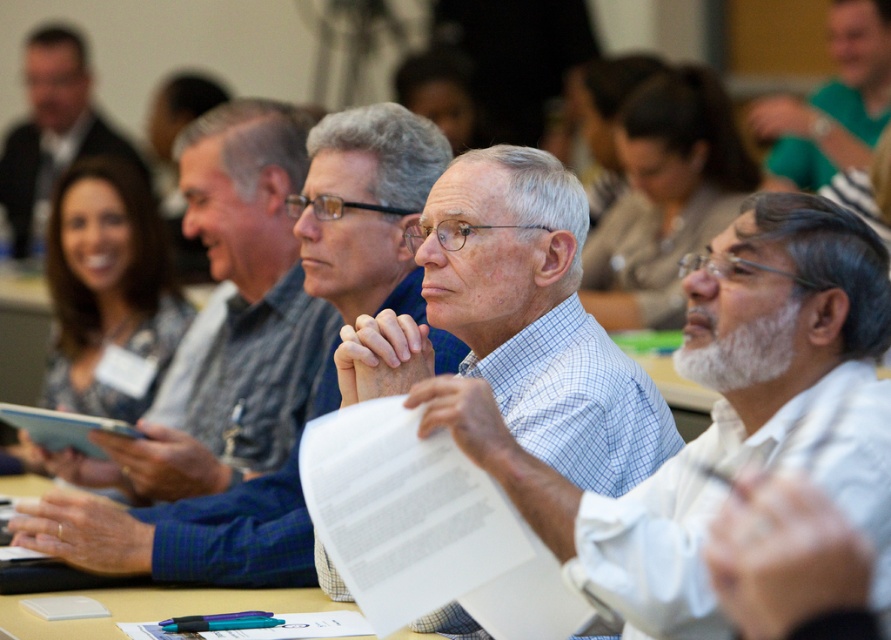
How far apart are blue plaid shirt at center and green jersey at upper right?

blue plaid shirt at center and green jersey at upper right are 2.22 meters apart.

Between blue plaid shirt at center and green jersey at upper right, which one is positioned lower?

blue plaid shirt at center

What do you see at coordinates (233, 316) in the screenshot? I see `blue plaid shirt at center` at bounding box center [233, 316].

Locate an element on the screen. The height and width of the screenshot is (640, 891). blue plaid shirt at center is located at coordinates (233, 316).

Does blue checkered shirt at center have a lesser width compared to matte black shirt at upper left?

Indeed, blue checkered shirt at center has a lesser width compared to matte black shirt at upper left.

Measure the distance between blue checkered shirt at center and matte black shirt at upper left.

They are 4.08 meters apart.

Which is in front, point (748, 304) or point (101, 138)?

Point (748, 304) is more forward.

Where is `blue checkered shirt at center`? The width and height of the screenshot is (891, 640). blue checkered shirt at center is located at coordinates (725, 413).

Is green jersey at upper right closer to camera compared to matte black shirt at upper left?

Yes.

Does green jersey at upper right appear under matte black shirt at upper left?

Indeed, green jersey at upper right is positioned under matte black shirt at upper left.

Where is `green jersey at upper right`? green jersey at upper right is located at coordinates (831, 104).

The height and width of the screenshot is (640, 891). Identify the location of green jersey at upper right. (831, 104).